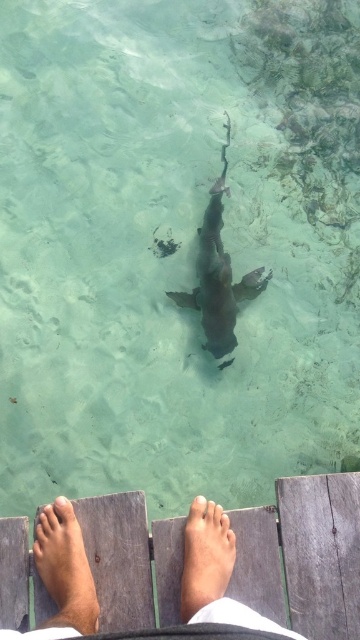
You are a lifeguard observing the scene from above. You notice the pink flesh at center and the pale skin toe at lower center. Which one is higher up in the image?

The pink flesh at center is taller than the pale skin toe at lower center, so it is higher up in the image.

You are a marine biologist observing the scene from above the water. You notice two areas of skin, the brown skin at lower center and the pink flesh at center. Which area is closer to the surface of the water?

The brown skin at lower center has a greater height compared to the pink flesh at center, meaning it is closer to the surface of the water.